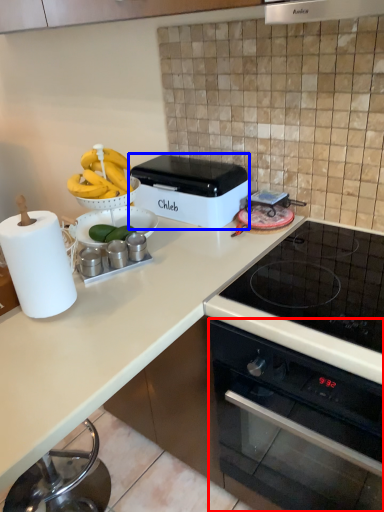
Question: Which of the following is the farthest to the observer, oven (highlighted by a red box) or kitchen appliance (highlighted by a blue box)?

Choices:
 (A) oven
 (B) kitchen appliance

Answer: (B)